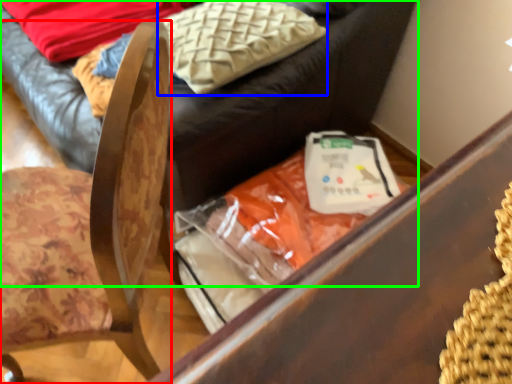
Question: Estimate the real-world distances between objects in this image. Which object is closer to chair (highlighted by a red box), pillow (highlighted by a blue box) or furniture (highlighted by a green box)?

Choices:
 (A) pillow
 (B) furniture

Answer: (A)